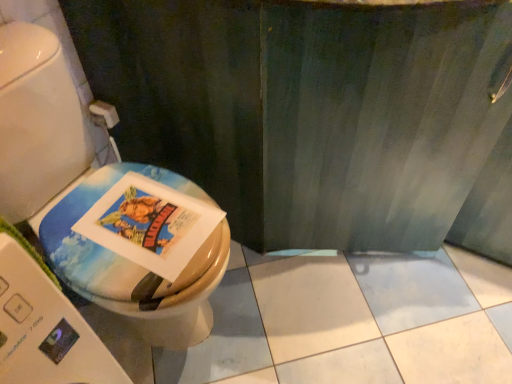
Question: In the image, is matte plastic toilet at left positioned in front of or behind matte paper comic book at center?

Choices:
 (A) front
 (B) behind

Answer: (A)

Question: Is matte plastic toilet at left taller or shorter than matte paper comic book at center?

Choices:
 (A) tall
 (B) short

Answer: (A)

Question: Which is nearer to the matte plastic toilet at left?

Choices:
 (A) white matte toilet paper at upper left
 (B) matte paper comic book at center

Answer: (B)

Question: Estimate the real-world distances between objects in this image. Which object is closer to the matte plastic toilet at left?

Choices:
 (A) matte paper comic book at center
 (B) white matte toilet paper at upper left

Answer: (A)